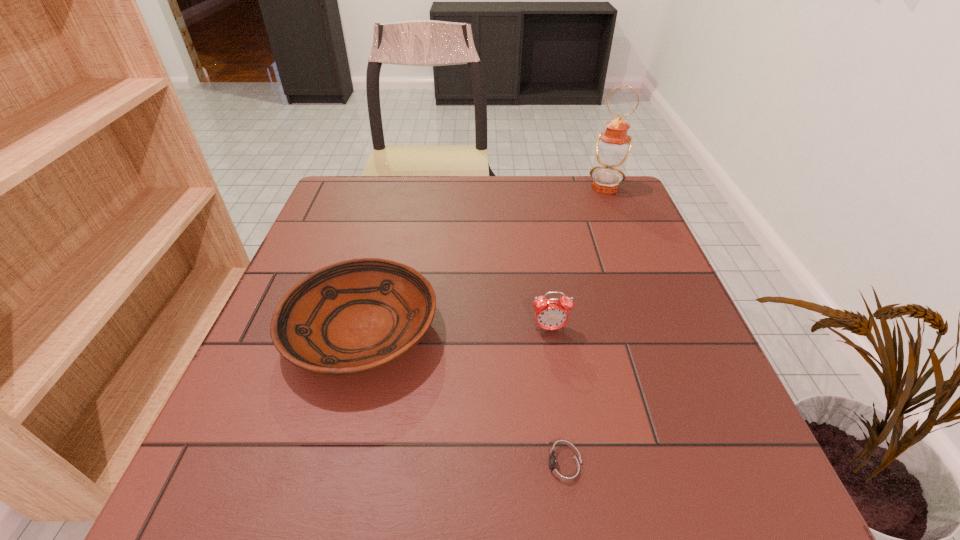
Identify the location of the rightmost object. (612, 147).

Image resolution: width=960 pixels, height=540 pixels. In order to click on the farthest object in this screenshot , I will do `click(612, 147)`.

Find the location of a particular element. This screenshot has height=540, width=960. alarm clock is located at coordinates (550, 314).

Locate an element on the screen. The image size is (960, 540). the leftmost object is located at coordinates (354, 316).

Image resolution: width=960 pixels, height=540 pixels. In order to click on plate in this screenshot , I will do `click(354, 316)`.

Where is `the nearest object`? the nearest object is located at coordinates (564, 468).

Where is `watch`? Image resolution: width=960 pixels, height=540 pixels. watch is located at coordinates pos(564,468).

You are a GUI agent. You are given a task and a screenshot of the screen. Output one action in this format:
    pyautogui.click(x=<x>, y=<y>)
    Task: Click on the blank area located 0.090m on the left of the oil lamp
    This screenshot has width=960, height=540.
    Given the screenshot: What is the action you would take?
    pyautogui.click(x=557, y=188)

Identify the location of vacant region located 0.210m on the face of the alarm clock. pyautogui.click(x=565, y=434).

This screenshot has height=540, width=960. I want to click on vacant space located 0.140m on the right of the plate, so click(508, 330).